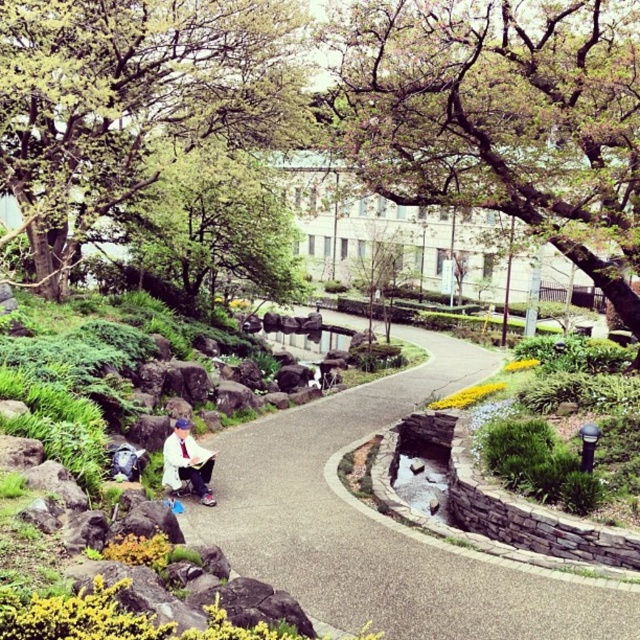
You are a park visitor who wants to take a photo of the green leafy tree at upper left and the white fabric shirt at center. Which object should you focus on first if you want to capture both in a single frame without moving your camera?

The green leafy tree at upper left is smaller in size compared to the white fabric shirt at center, so you should focus on the white fabric shirt at center first to ensure it fits properly in the frame while still capturing the smaller tree in the background.

In the scene shown: You are standing at the entrance of the park and want to find the green leafy tree at upper left. According to the coordinates provided, what are the exact coordinates where you should look to locate it?

The green leafy tree at upper left is located at coordinates point (x=132, y=100).